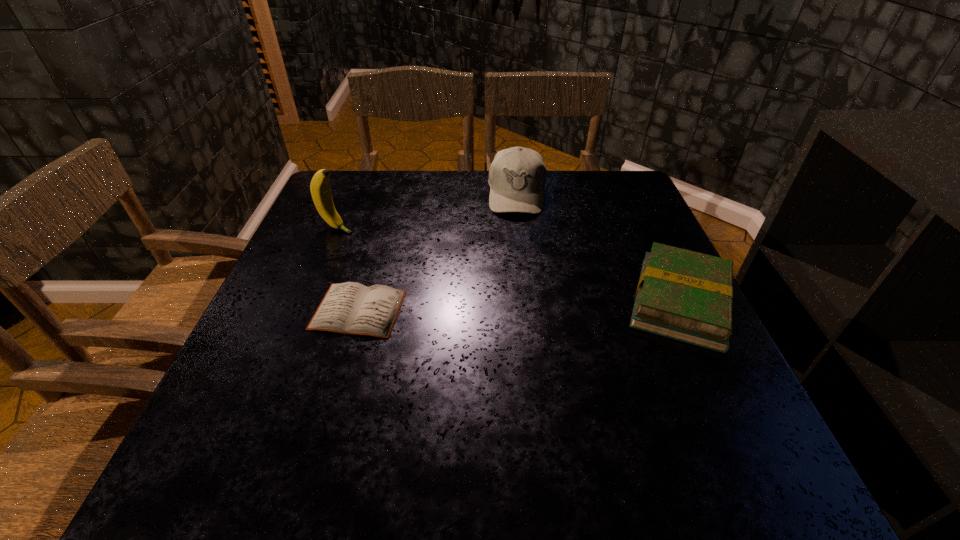
In the image, there is a desktop. Where is `vacant space at the near edge`? vacant space at the near edge is located at coordinates (572, 410).

The width and height of the screenshot is (960, 540). Find the location of `free spot at the left edge of the desktop`. free spot at the left edge of the desktop is located at coordinates (245, 360).

Locate an element on the screen. The image size is (960, 540). vacant space at the right edge is located at coordinates (626, 305).

Where is `free space at the far left corner`? free space at the far left corner is located at coordinates (358, 179).

Find the location of a particular element. The height and width of the screenshot is (540, 960). vacant space at the far right corner of the desktop is located at coordinates (594, 178).

At what (x,y) coordinates should I click in order to perform the action: click on free area in between the third shortest object and the third nearest object. Please return your answer as a coordinate pair (x, y). This screenshot has width=960, height=540. Looking at the image, I should click on (427, 211).

Find the location of a particular element. The image size is (960, 540). empty space that is in between the tallest object and the rightmost object is located at coordinates (509, 265).

Find the location of a particular element. This screenshot has width=960, height=540. free space between the rightmost object and the shortest object is located at coordinates (519, 306).

Locate an element on the screen. This screenshot has height=540, width=960. free space that is in between the shortest object and the third shortest object is located at coordinates (438, 252).

This screenshot has height=540, width=960. Identify the location of empty location between the tallest object and the diary. (348, 269).